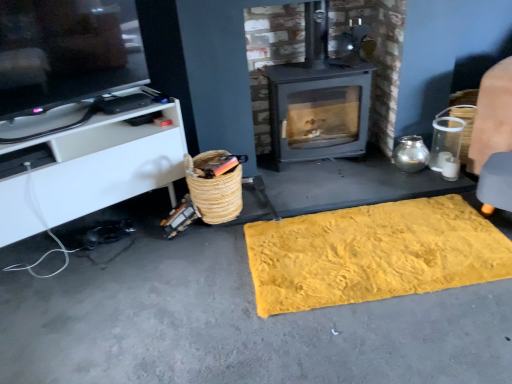
You are a GUI agent. You are given a task and a screenshot of the screen. Output one action in this format:
    pyautogui.click(x=<x>, y=<y>)
    Task: Click on the free point below matte gray wood burning stove at center (from a real-world perspective)
    The height and width of the screenshot is (384, 512).
    Given the screenshot: What is the action you would take?
    pyautogui.click(x=322, y=166)